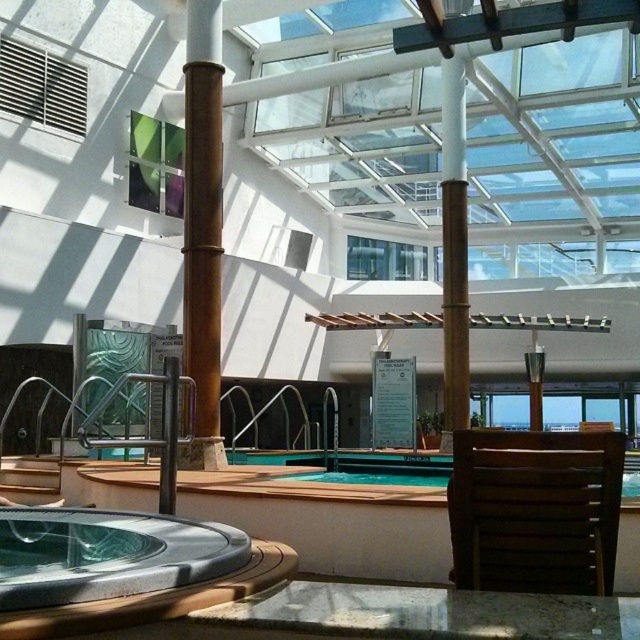
You are a guest at the spa and want to move from the brown wooden chair at center to the smooth gray hot tub at lower left. Which object will you encounter first as you walk towards the hot tub?

You will encounter the smooth gray hot tub at lower left first because it is closer to you than the brown wooden chair at center, which is further away.

You are a guest at the spa and want to sit on the brown wooden chair at center. However, there is a brown polished wood beam at center nearby. Can you sit comfortably without bumping into the beam?

The brown wooden chair at center has a larger size compared to the brown polished wood beam at center, so there might not be enough space to sit comfortably without bumping into the beam.

You are standing at the entrance of the spa and want to move towards the wooden deck around the hot tub. You notice two points marked in the image. Which point, point (600, 444) or point (205, 260), is closer to your current position?

Point (600, 444) is closer to your current position because it is in front of point (205, 260).